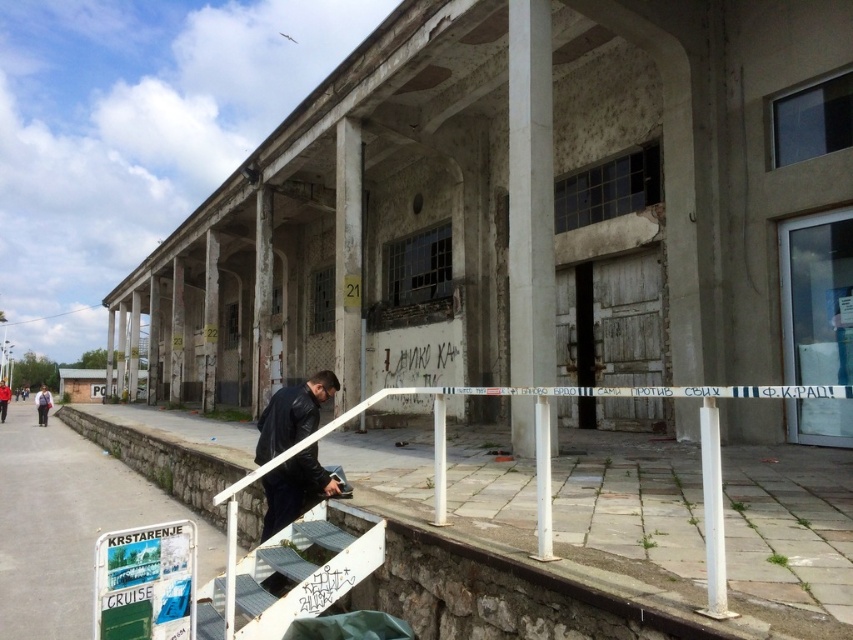
The height and width of the screenshot is (640, 853). Describe the element at coordinates (303, 570) in the screenshot. I see `metallic/stainless steel stairs at lower center` at that location.

Based on the photo, who is shorter, metallic/stainless steel stairs at lower center or dark blue leather jacket at lower center?

metallic/stainless steel stairs at lower center

Which is in front, point (283, 541) or point (263, 422)?

Positioned in front is point (283, 541).

Identify the location of metallic/stainless steel stairs at lower center. The width and height of the screenshot is (853, 640). (303, 570).

Is white metal railing at lower center to the left of gray concrete pavement at lower left from the viewer's perspective?

In fact, white metal railing at lower center is to the right of gray concrete pavement at lower left.

Is white metal railing at lower center shorter than gray concrete pavement at lower left?

Indeed, white metal railing at lower center has a lesser height compared to gray concrete pavement at lower left.

Where is `white metal railing at lower center`? This screenshot has height=640, width=853. white metal railing at lower center is located at coordinates (788, 538).

Is white metal railing at lower center to the left of dark blue leather jacket at lower left from the viewer's perspective?

No, white metal railing at lower center is not to the left of dark blue leather jacket at lower left.

Based on the photo, between white metal railing at lower center and dark blue leather jacket at lower left, which one has more height?

With more height is dark blue leather jacket at lower left.

Which is in front, point (697, 586) or point (47, 396)?

Point (697, 586) is in front.

I want to click on white metal railing at lower center, so click(x=788, y=538).